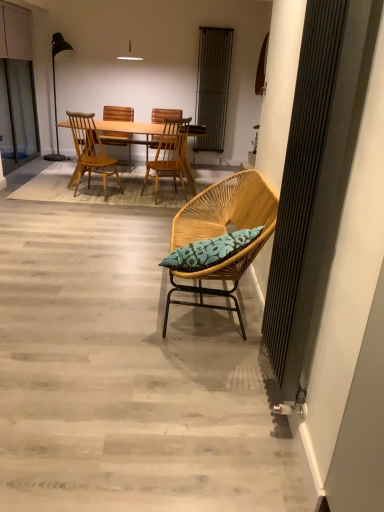
Question: Is matte black floor lamp at left further to camera compared to wooden beach chair at center?

Choices:
 (A) no
 (B) yes

Answer: (B)

Question: From a real-world perspective, is matte black floor lamp at left beneath wooden beach chair at center?

Choices:
 (A) yes
 (B) no

Answer: (B)

Question: Is matte black floor lamp at left facing towards wooden beach chair at center?

Choices:
 (A) no
 (B) yes

Answer: (A)

Question: Does matte black floor lamp at left have a greater width compared to wooden beach chair at center?

Choices:
 (A) no
 (B) yes

Answer: (A)

Question: From the image's perspective, is matte black floor lamp at left above wooden beach chair at center?

Choices:
 (A) yes
 (B) no

Answer: (A)

Question: Is matte black floor lamp at left outside of wooden beach chair at center?

Choices:
 (A) no
 (B) yes

Answer: (B)

Question: Is matte black floor lamp at left to the left of green leafy plant at upper right from the viewer's perspective?

Choices:
 (A) yes
 (B) no

Answer: (A)

Question: From the image's perspective, is matte black floor lamp at left located above green leafy plant at upper right?

Choices:
 (A) yes
 (B) no

Answer: (A)

Question: From a real-world perspective, is matte black floor lamp at left physically below green leafy plant at upper right?

Choices:
 (A) yes
 (B) no

Answer: (B)

Question: Is matte black floor lamp at left wider than green leafy plant at upper right?

Choices:
 (A) no
 (B) yes

Answer: (B)

Question: Does matte black floor lamp at left have a lesser width compared to green leafy plant at upper right?

Choices:
 (A) yes
 (B) no

Answer: (B)

Question: Does matte black floor lamp at left appear on the right side of green leafy plant at upper right?

Choices:
 (A) yes
 (B) no

Answer: (B)

Question: Is wooden chair at center, arranged as the 4th chair when viewed from the front, positioned far away from wooden chair at center, the third chair viewed from the front?

Choices:
 (A) yes
 (B) no

Answer: (B)